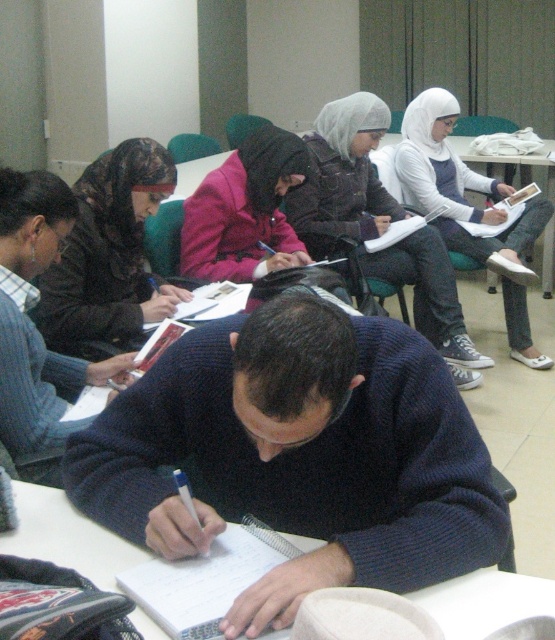
Based on the photo, does dark blue sweater at center appear on the left side of matte black hijab at upper left?

Incorrect, dark blue sweater at center is not on the left side of matte black hijab at upper left.

Can you confirm if dark blue sweater at center is smaller than matte black hijab at upper left?

Actually, dark blue sweater at center might be larger than matte black hijab at upper left.

Is point (347, 579) farther from viewer compared to point (87, 205)?

No, it is not.

In order to click on dark blue sweater at center in this screenshot , I will do `click(299, 454)`.

Between matte black hijab at upper left and white knit sweater at upper center, which one appears on the left side from the viewer's perspective?

matte black hijab at upper left

Is the position of matte black hijab at upper left less distant than that of white knit sweater at upper center?

Yes, it is.

Is point (108, 250) closer to viewer compared to point (356, 157)?

Yes, point (108, 250) is closer to viewer.

At what (x,y) coordinates should I click in order to perform the action: click on matte black hijab at upper left. Please return your answer as a coordinate pair (x, y). This screenshot has height=640, width=555. Looking at the image, I should click on (109, 257).

In the scene shown: Can you confirm if dark blue sweater at center is shorter than pink fabric hijab at center?

Correct, dark blue sweater at center is not as tall as pink fabric hijab at center.

Can you confirm if dark blue sweater at center is positioned to the right of pink fabric hijab at center?

Correct, you'll find dark blue sweater at center to the right of pink fabric hijab at center.

Which is in front, point (290, 484) or point (228, 244)?

Point (290, 484) is in front.

Where is `dark blue sweater at center`? The height and width of the screenshot is (640, 555). dark blue sweater at center is located at coordinates (299, 454).